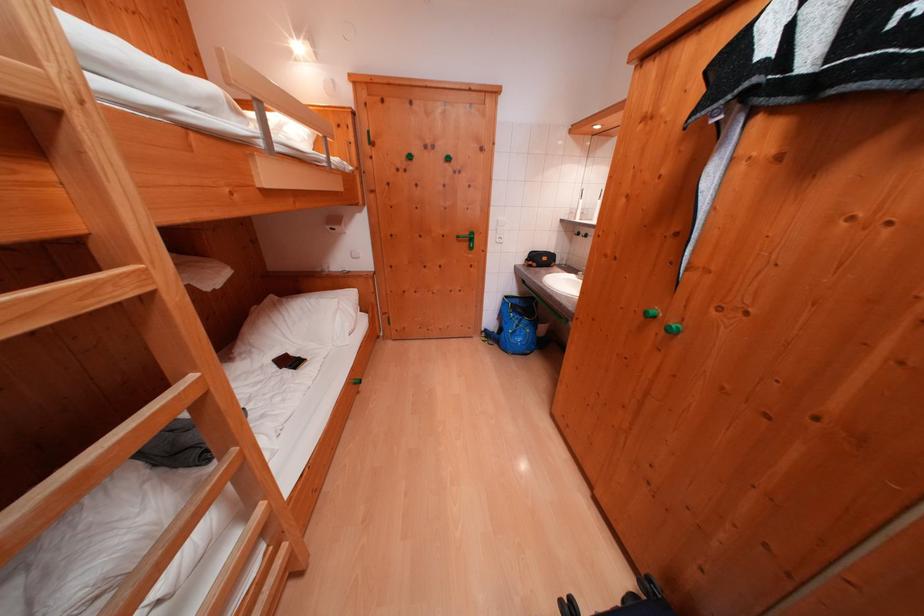
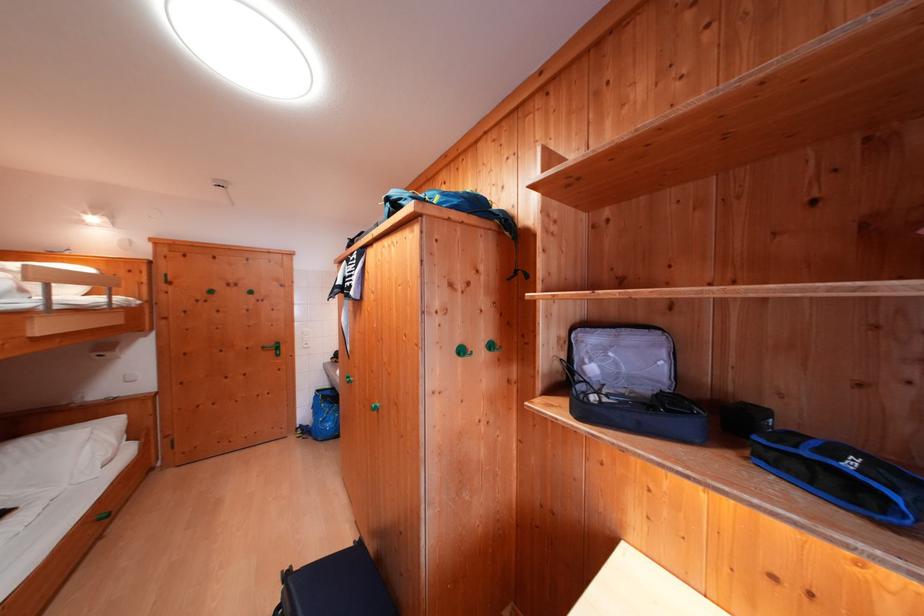
Find the pixel in the second image that matches point 363,387 in the first image.

(108, 524)